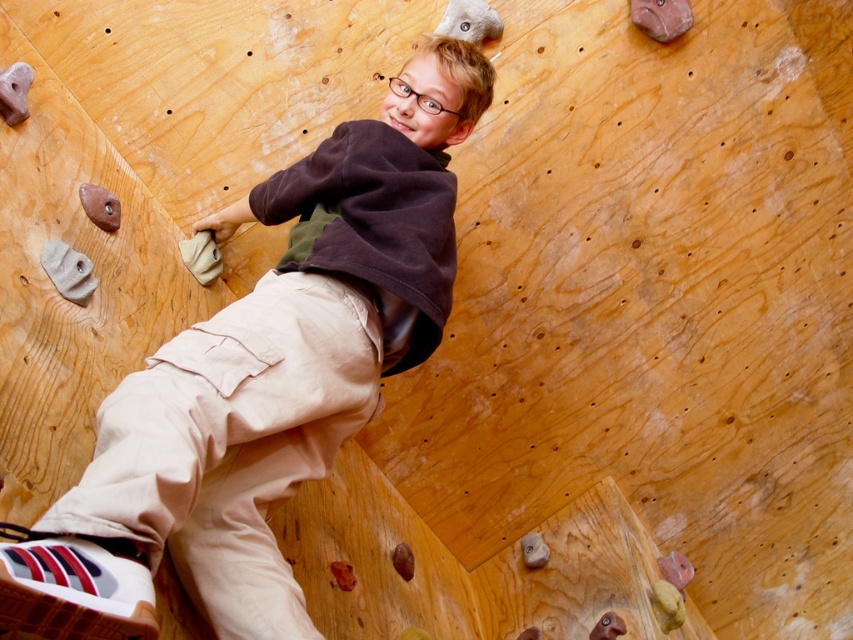
Question: Is brown cotton shirt at upper center above khaki pants at center?

Choices:
 (A) no
 (B) yes

Answer: (B)

Question: Which point is closer to the camera taking this photo?

Choices:
 (A) (300, 371)
 (B) (344, 225)

Answer: (A)

Question: Does brown cotton shirt at upper center have a greater width compared to khaki pants at center?

Choices:
 (A) yes
 (B) no

Answer: (A)

Question: Can you confirm if brown cotton shirt at upper center is positioned above khaki pants at center?

Choices:
 (A) yes
 (B) no

Answer: (A)